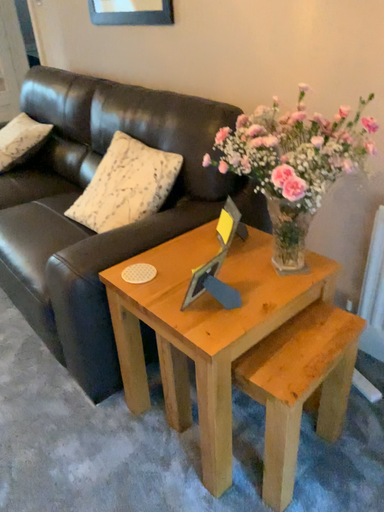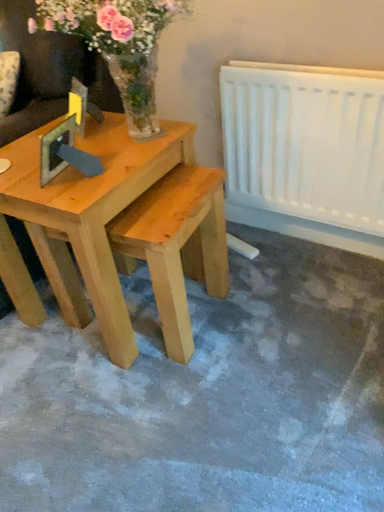
Question: How did the camera likely rotate when shooting the video?

Choices:
 (A) rotated left
 (B) rotated right

Answer: (B)